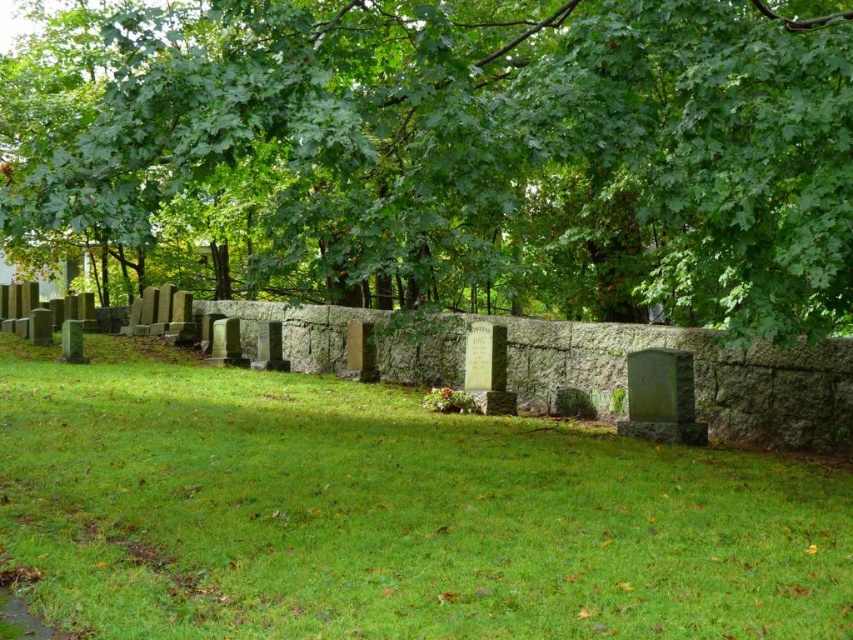
Consider the image. Measure the distance between green leafy tree at upper center and green grassy at center.

green leafy tree at upper center is 5.50 meters from green grassy at center.

Is green leafy tree at upper center to the left of green grassy at center from the viewer's perspective?

Yes, green leafy tree at upper center is to the left of green grassy at center.

Identify the location of green leafy tree at upper center. This screenshot has height=640, width=853. (451, 150).